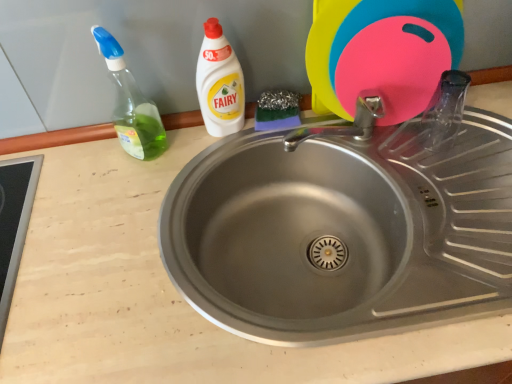
Question: Based on their sizes in the image, would you say stainless steel sink at center is bigger or smaller than white plastic bottle at upper center?

Choices:
 (A) big
 (B) small

Answer: (A)

Question: Considering the positions of point (221, 172) and point (200, 57), is point (221, 172) closer or farther from the camera than point (200, 57)?

Choices:
 (A) closer
 (B) farther

Answer: (B)

Question: Based on their relative distances, which object is farther from the green translucent bottle at left?

Choices:
 (A) white plastic bottle at upper center
 (B) stainless steel sink at center
 (C) pink rubber cutting board at upper right

Answer: (C)

Question: Based on their relative distances, which object is farther from the stainless steel sink at center?

Choices:
 (A) white plastic bottle at upper center
 (B) green translucent bottle at left
 (C) pink rubber cutting board at upper right

Answer: (B)